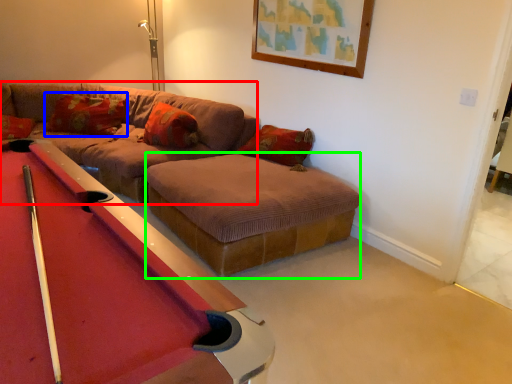
Question: Which object is the farthest from couch (highlighted by a red box)? Choose among these: pillow (highlighted by a blue box) or footrest (highlighted by a green box).

Choices:
 (A) pillow
 (B) footrest

Answer: (B)